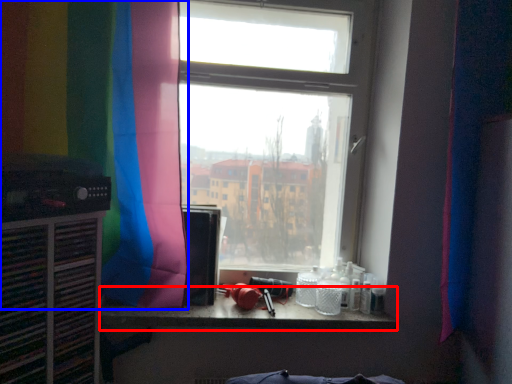
Question: Which of the following is the closest to the observer, counter top (highlighted by a red box) or curtain (highlighted by a blue box)?

Choices:
 (A) counter top
 (B) curtain

Answer: (B)